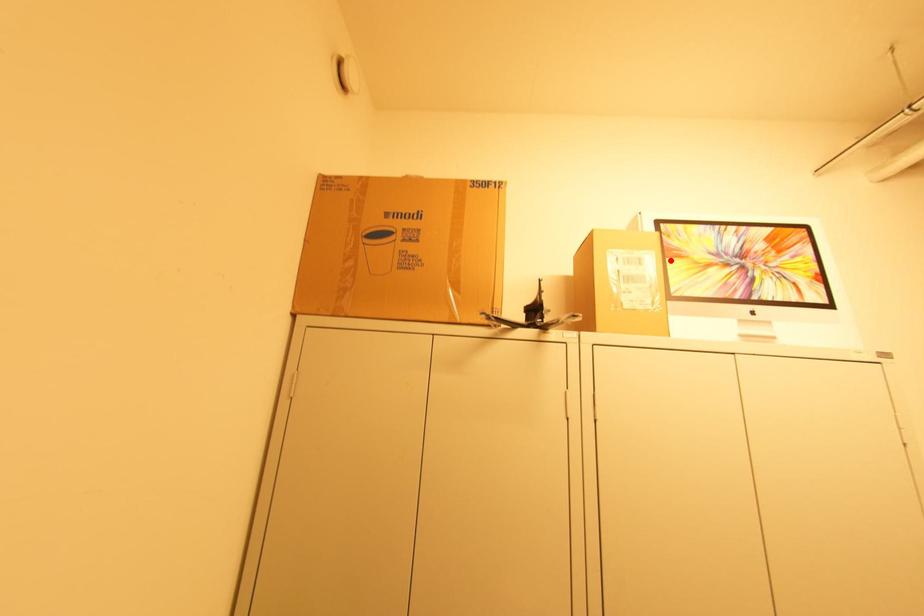
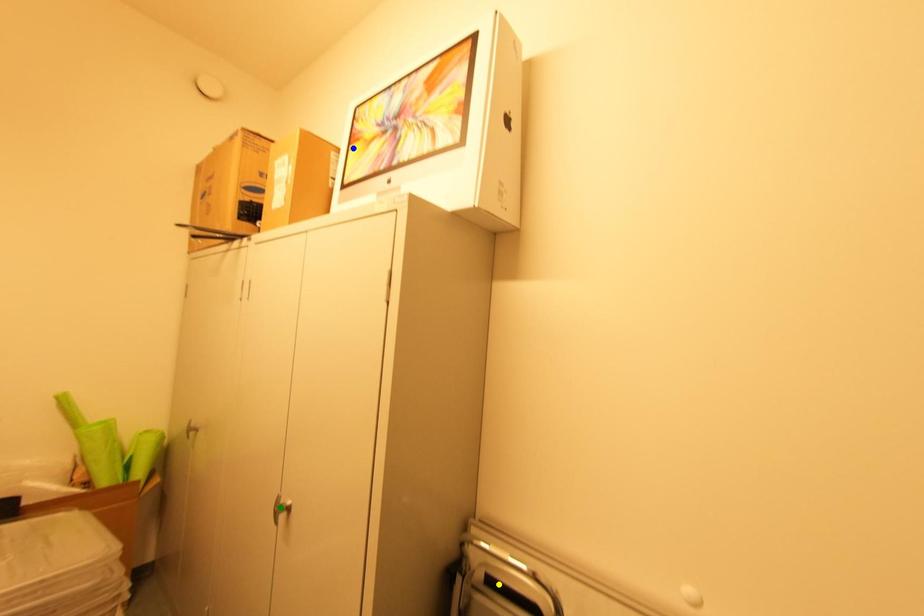
Question: I am providing you with two images of the same scene from different viewpoints. A red point is marked on the first image. You are given multiple points on the second image. In image 2, which mark is for the same physical point as the one in image 1?

Choices:
 (A) yellow point
 (B) green point
 (C) blue point

Answer: (C)